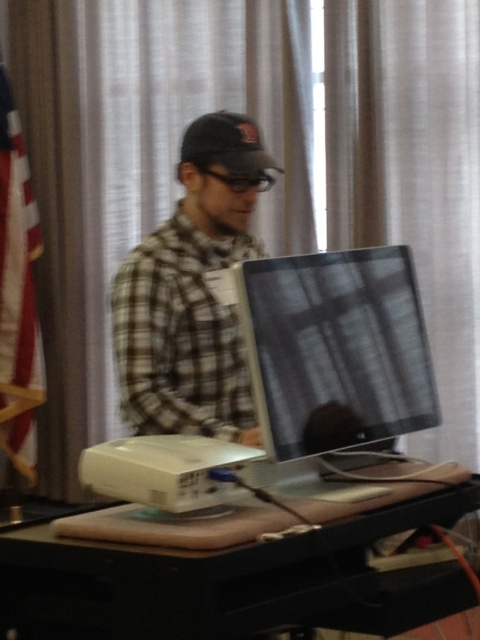
Which is more to the left, red-white-blue fabric flag at left or dark gray matte baseball cap at center?

From the viewer's perspective, red-white-blue fabric flag at left appears more on the left side.

Does point (2, 179) lie behind point (241, 131)?

Yes, it is.

Where is `red-white-blue fabric flag at left`? Image resolution: width=480 pixels, height=640 pixels. red-white-blue fabric flag at left is located at coordinates (17, 294).

Identify the location of red-white-blue fabric flag at left. (17, 294).

Is point (420, 394) closer to viewer compared to point (191, 150)?

Yes, point (420, 394) is in front of point (191, 150).

Between point (321, 292) and point (120, 301), which one is positioned behind?

Point (120, 301)

At what (x,y) coordinates should I click in order to perform the action: click on matte black monitor at center. Please return your answer as a coordinate pair (x, y). This screenshot has height=640, width=480. Looking at the image, I should click on (336, 349).

Does matte black monitor at center have a larger size compared to dark gray matte baseball cap at center?

Yes.

Is matte black monitor at center positioned at the back of dark gray matte baseball cap at center?

No, it is in front of dark gray matte baseball cap at center.

Does point (256, 400) come closer to viewer compared to point (181, 150)?

Yes.

Locate an element on the screen. The image size is (480, 640). matte black monitor at center is located at coordinates (336, 349).